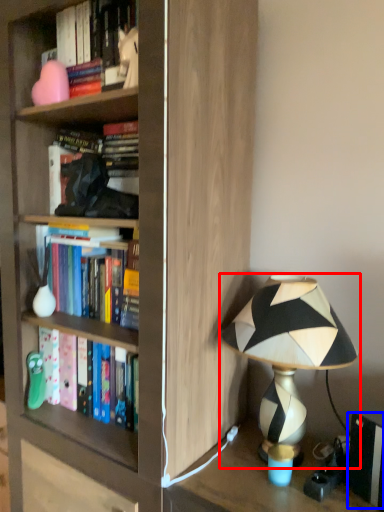
Question: Which object is further to the camera taking this photo, lamp (highlighted by a red box) or paperback book (highlighted by a blue box)?

Choices:
 (A) lamp
 (B) paperback book

Answer: (B)